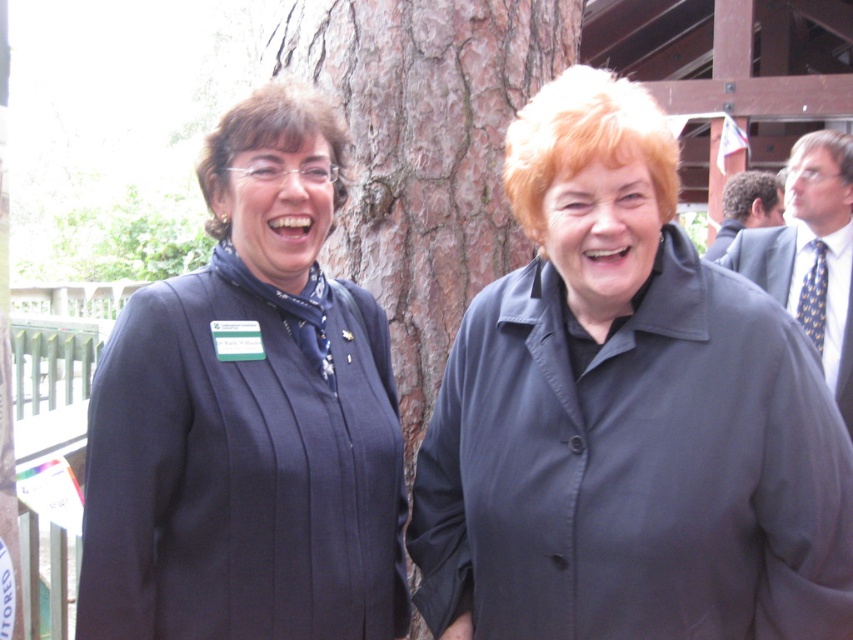
Question: Which is nearer to the matte black blazer at left?

Choices:
 (A) polka dot tie at right
 (B) brown rough bark at center

Answer: (B)

Question: Which of these objects is positioned farthest from the brown rough bark at center?

Choices:
 (A) matte black blazer at left
 (B) dark blue suit at right

Answer: (B)

Question: Can you confirm if matte black blazer at left is thinner than polka dot tie at right?

Choices:
 (A) no
 (B) yes

Answer: (A)

Question: Which point is farther to the camera?

Choices:
 (A) (792, 248)
 (B) (344, 26)
 (C) (740, 227)
 (D) (209, 516)

Answer: (C)

Question: Does matte black blazer at left appear over polka dot tie at right?

Choices:
 (A) no
 (B) yes

Answer: (A)

Question: Can you confirm if matte black blazer at left is wider than dark blue suit at right?

Choices:
 (A) no
 (B) yes

Answer: (A)